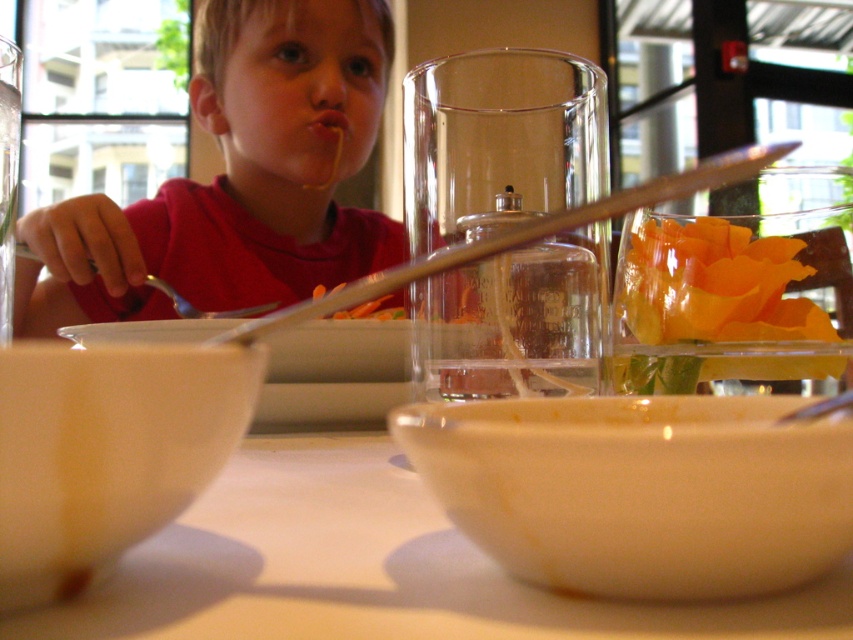
Question: Which point is closer to the camera taking this photo?

Choices:
 (A) (374, 376)
 (B) (753, 426)
 (C) (674, 180)
 (D) (323, 628)

Answer: (C)

Question: Is white glossy table at center thinner than white matte bowl at lower center?

Choices:
 (A) yes
 (B) no

Answer: (B)

Question: Among these objects, which one is nearest to the camera?

Choices:
 (A) white matte bowl at lower left
 (B) matte red shirt at upper left

Answer: (A)

Question: Which point is farther from the camera taking this photo?

Choices:
 (A) (772, 563)
 (B) (74, 240)

Answer: (B)

Question: Is white matte bowl at lower center closer to the viewer compared to matte red shirt at upper left?

Choices:
 (A) no
 (B) yes

Answer: (B)

Question: Is white matte bowl at lower center further to camera compared to white matte bowl at lower left?

Choices:
 (A) yes
 (B) no

Answer: (B)